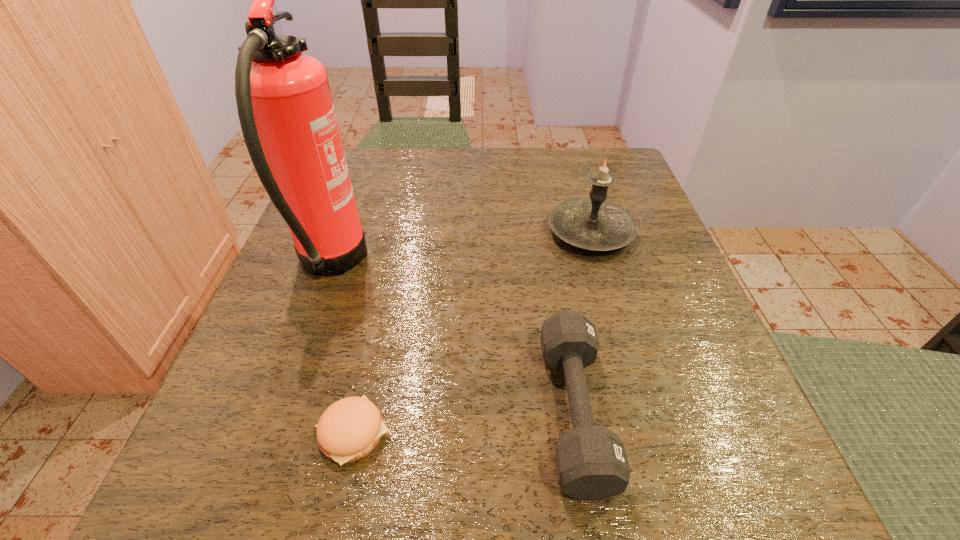
Find the location of a particular element. free space that is in between the dumbbell and the fire extinguisher is located at coordinates (452, 338).

Locate an element on the screen. This screenshot has width=960, height=540. free space between the shortest object and the fire extinguisher is located at coordinates (342, 349).

Where is `unoccupied position between the dumbbell and the shortest object`? This screenshot has height=540, width=960. unoccupied position between the dumbbell and the shortest object is located at coordinates coord(464,422).

This screenshot has width=960, height=540. Find the location of `free point between the candle and the patty`. free point between the candle and the patty is located at coordinates (472, 333).

Where is `free space between the second shortest object and the fire extinguisher`? This screenshot has width=960, height=540. free space between the second shortest object and the fire extinguisher is located at coordinates (452, 338).

At what (x,y) coordinates should I click in order to perform the action: click on vacant point located between the fire extinguisher and the third shortest object. Please return your answer as a coordinate pair (x, y). The width and height of the screenshot is (960, 540). Looking at the image, I should click on (460, 248).

Find the location of a particular element. This screenshot has width=960, height=540. free space between the fire extinguisher and the candle is located at coordinates (460, 248).

Identify the location of free point between the patty and the fire extinguisher. This screenshot has height=540, width=960. (342, 349).

Identify which object is located as the third nearest to the shortest object. Please provide its 2D coordinates. Your answer should be formatted as a tuple, i.e. [(x, y)], where the tuple contains the x and y coordinates of a point satisfying the conditions above.

[(593, 223)]

Select which object appears as the second closest to the second shortest object. Please provide its 2D coordinates. Your answer should be formatted as a tuple, i.e. [(x, y)], where the tuple contains the x and y coordinates of a point satisfying the conditions above.

[(349, 429)]